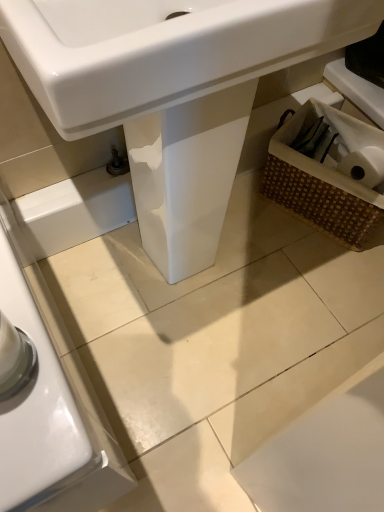
Question: From the image's perspective, is white glossy sink at center above or below woven brown basket at lower right?

Choices:
 (A) below
 (B) above

Answer: (A)

Question: Looking at the image, does white glossy sink at center seem bigger or smaller compared to woven brown basket at lower right?

Choices:
 (A) small
 (B) big

Answer: (B)

Question: Based on their relative distances, which object is farther from the white glossy sink at center?

Choices:
 (A) woven brown basket at lower right
 (B) woven brown basket at lower right

Answer: (A)

Question: Which is farther from the woven brown basket at lower right?

Choices:
 (A) woven brown basket at lower right
 (B) white glossy sink at center

Answer: (B)